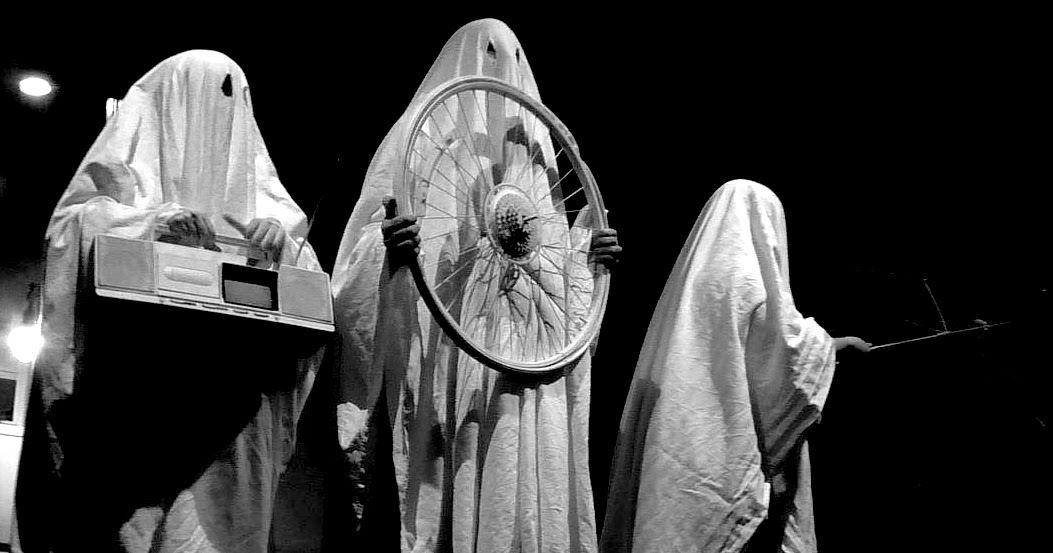
This screenshot has height=553, width=1053. What are the coordinates of `speaker` in the screenshot? It's located at (117, 266).